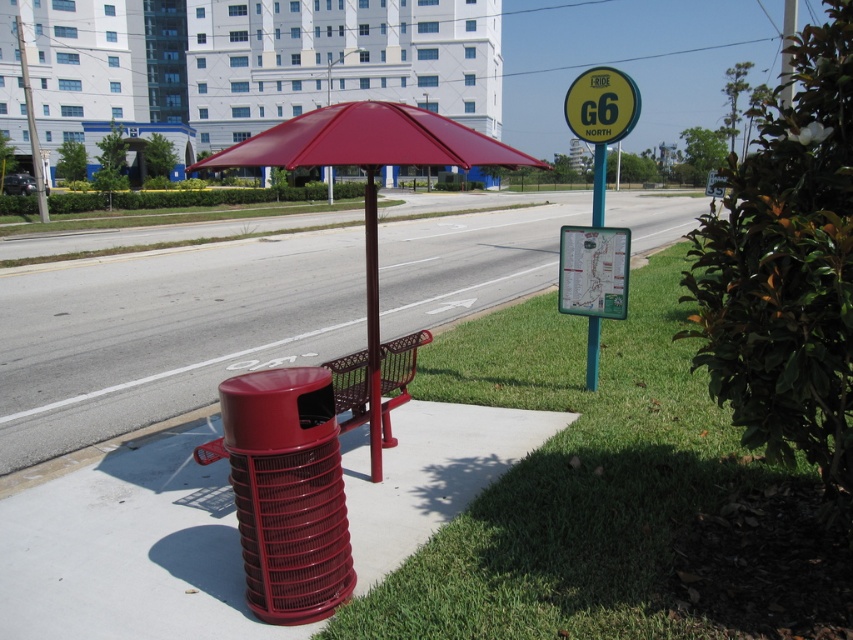
Question: Is green grass at lower right further to camera compared to glossy plastic trash can at lower left?

Choices:
 (A) no
 (B) yes

Answer: (A)

Question: Does glossy plastic trash can at lower left appear over yellow-green plastic sign at upper right?

Choices:
 (A) no
 (B) yes

Answer: (A)

Question: Which is nearer to the green plastic map at right?

Choices:
 (A) glossy plastic trash can at lower left
 (B) yellow-green plastic sign at upper right
 (C) matte red umbrella at center
 (D) blue metallic pole at upper center

Answer: (D)

Question: Is green grass at lower right positioned before glossy plastic trash can at lower left?

Choices:
 (A) no
 (B) yes

Answer: (B)

Question: Among these objects, which one is nearest to the camera?

Choices:
 (A) yellow-green plastic sign at upper right
 (B) glossy plastic trash can at lower left
 (C) green grass at lower right

Answer: (C)

Question: Estimate the real-world distances between objects in this image. Which object is farther from the yellow-green plastic sign at upper right?

Choices:
 (A) matte red umbrella at center
 (B) green plastic map at right

Answer: (A)